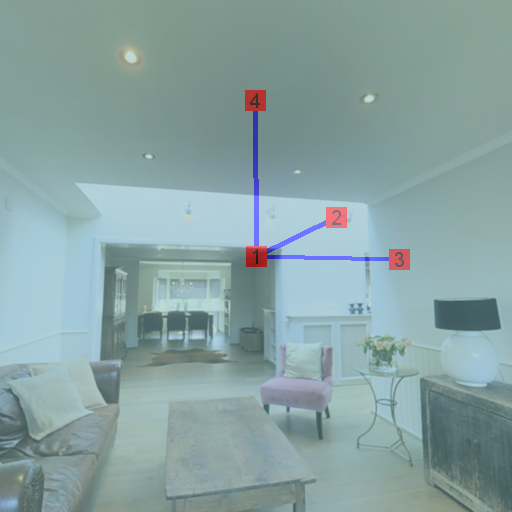
The image size is (512, 512). What are the coordinates of `cushion` in the screenshot? It's located at (45, 415).